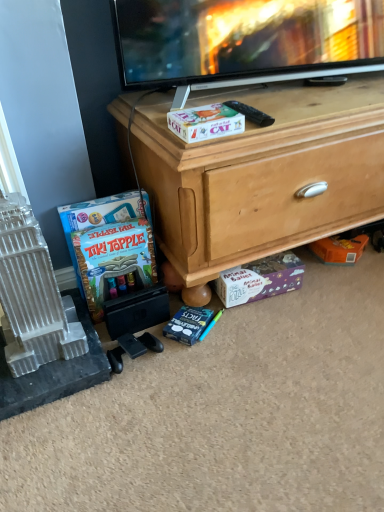
Question: Is wooden chest at center with matte board game at lower left?

Choices:
 (A) no
 (B) yes

Answer: (A)

Question: From a real-world perspective, is wooden chest at center below matte board game at lower left?

Choices:
 (A) no
 (B) yes

Answer: (A)

Question: From the image's perspective, is wooden chest at center located beneath matte board game at lower left?

Choices:
 (A) yes
 (B) no

Answer: (B)

Question: Considering the relative positions of wooden chest at center and matte board game at lower left in the image provided, is wooden chest at center to the right of matte board game at lower left from the viewer's perspective?

Choices:
 (A) yes
 (B) no

Answer: (A)

Question: Considering the relative sizes of wooden chest at center and matte board game at lower left in the image provided, is wooden chest at center taller than matte board game at lower left?

Choices:
 (A) yes
 (B) no

Answer: (A)

Question: From a real-world perspective, is wooden chest at center physically above matte board game at lower left?

Choices:
 (A) no
 (B) yes

Answer: (B)

Question: From a real-world perspective, is purple cardboard puzzle box at lower center on top of black plastic remote control at upper center?

Choices:
 (A) no
 (B) yes

Answer: (A)

Question: Can you confirm if purple cardboard puzzle box at lower center is shorter than black plastic remote control at upper center?

Choices:
 (A) yes
 (B) no

Answer: (B)

Question: Does purple cardboard puzzle box at lower center turn towards black plastic remote control at upper center?

Choices:
 (A) yes
 (B) no

Answer: (B)

Question: Is the depth of purple cardboard puzzle box at lower center greater than that of black plastic remote control at upper center?

Choices:
 (A) yes
 (B) no

Answer: (A)

Question: Does purple cardboard puzzle box at lower center have a lesser width compared to black plastic remote control at upper center?

Choices:
 (A) no
 (B) yes

Answer: (B)

Question: Does purple cardboard puzzle box at lower center appear on the right side of black plastic remote control at upper center?

Choices:
 (A) no
 (B) yes

Answer: (B)

Question: Is matte board game at lower left not inside white plastic building at left?

Choices:
 (A) yes
 (B) no

Answer: (A)